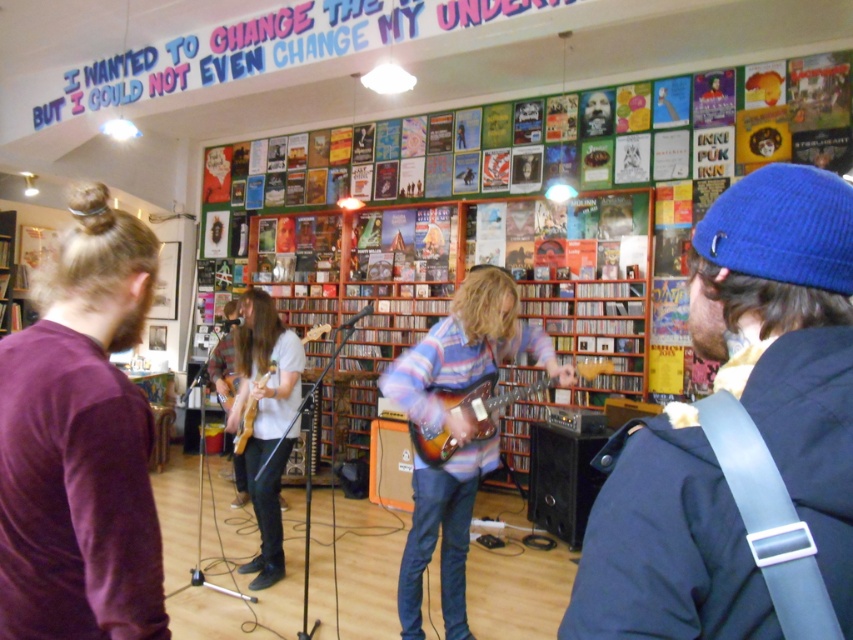
Does point (265, 332) come farther from viewer compared to point (428, 445)?

That is True.

Which of these two, white matte shirt at center or sunburst wood electric guitar at center, stands shorter?

sunburst wood electric guitar at center

Who is more distant from viewer, (258, 586) or (438, 438)?

The point (258, 586) is more distant.

At what (x,y) coordinates should I click in order to perform the action: click on white matte shirt at center. Please return your answer as a coordinate pair (x, y). Looking at the image, I should click on (265, 420).

How much distance is there between sunburst wood electric guitar at center and wooden acoustic guitar at center?

The distance of sunburst wood electric guitar at center from wooden acoustic guitar at center is 1.23 meters.

Does sunburst wood electric guitar at center appear over wooden acoustic guitar at center?

Yes, sunburst wood electric guitar at center is above wooden acoustic guitar at center.

Between point (451, 392) and point (245, 412), which one is positioned behind?

Point (245, 412)

The height and width of the screenshot is (640, 853). In order to click on sunburst wood electric guitar at center in this screenshot , I will do `click(486, 401)`.

Does blue knit beanie at upper right lie in front of striped cotton shirt at center?

Yes, blue knit beanie at upper right is in front of striped cotton shirt at center.

Is blue knit beanie at upper right to the right of striped cotton shirt at center from the viewer's perspective?

Indeed, blue knit beanie at upper right is positioned on the right side of striped cotton shirt at center.

Image resolution: width=853 pixels, height=640 pixels. What are the coordinates of `blue knit beanie at upper right` in the screenshot? It's located at (740, 440).

The image size is (853, 640). What are the coordinates of `blue knit beanie at upper right` in the screenshot? It's located at (740, 440).